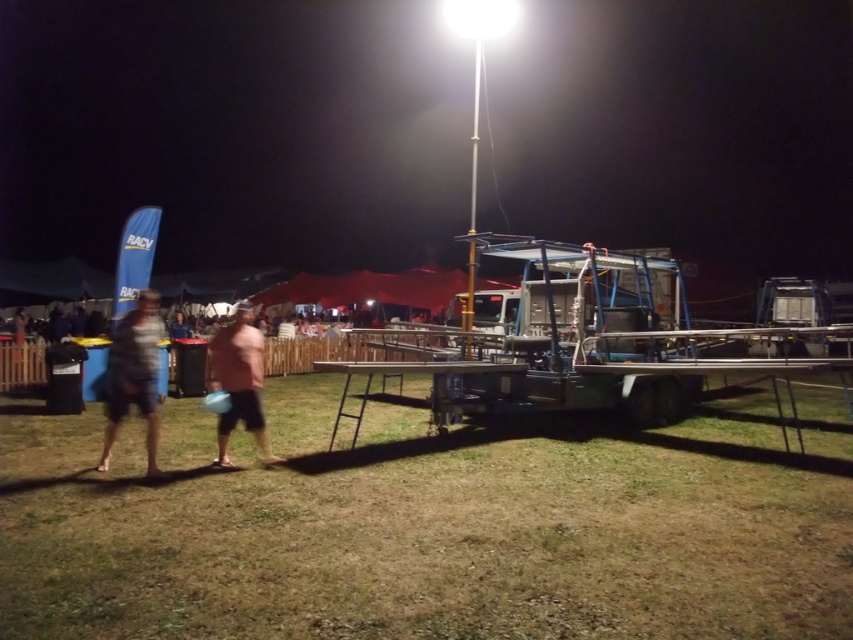
Question: Does metallic trailer at center have a larger size compared to gray fabric shorts at lower left?

Choices:
 (A) yes
 (B) no

Answer: (A)

Question: Is green grass at lower center positioned before gray fabric shorts at lower left?

Choices:
 (A) yes
 (B) no

Answer: (A)

Question: Considering the real-world distances, which object is closest to the pink matte shirt at center?

Choices:
 (A) green grass at lower center
 (B) gray fabric shorts at lower left
 (C) metallic trailer at center

Answer: (B)

Question: Is metallic trailer at center above gray fabric shorts at lower left?

Choices:
 (A) no
 (B) yes

Answer: (B)

Question: Which of the following is the farthest from the observer?

Choices:
 (A) (248, 387)
 (B) (721, 570)
 (C) (132, 396)

Answer: (A)

Question: Which object appears closest to the camera in this image?

Choices:
 (A) pink matte shirt at center
 (B) green grass at lower center
 (C) gray fabric shorts at lower left

Answer: (B)